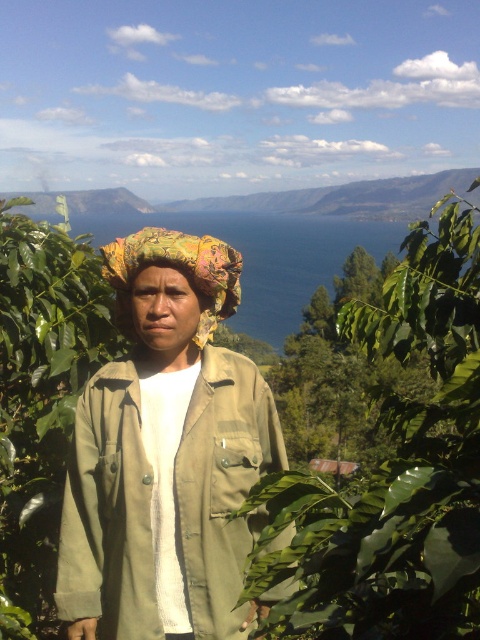
You are a photographer trying to capture a portrait of the person wearing the olive green fabric trench coat at center. There is a green leafy plant at center in the background that might block the view. Can you tell if the plant is larger than the coat?

The green leafy plant at center is bigger than the olive green fabric trench coat at center, so the plant may obstruct the view of the coat in the portrait.

You are a fashion designer observing a model wearing the olive green fabric trench coat at center and the printed fabric headscarf at center. Which item is located higher on the model?

The printed fabric headscarf at center is located higher than the olive green fabric trench coat at center because it is positioned above it.